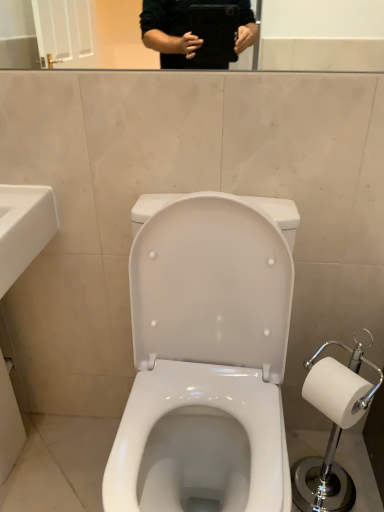
Where is `white plastic toilet paper holder at right`? The image size is (384, 512). white plastic toilet paper holder at right is located at coordinates (332, 428).

From the image's perspective, which one is positioned higher, white ceramic sink at lower left or white plastic toilet paper holder at right?

From the image's view, white ceramic sink at lower left is above.

Is white plastic toilet paper holder at right a part of white ceramic sink at lower left?

Actually, white plastic toilet paper holder at right is outside white ceramic sink at lower left.

Which is in front, point (6, 275) or point (315, 380)?

The point (6, 275) is closer to the camera.

Considering the relative positions of white ceramic sink at lower left and white plastic toilet paper holder at right in the image provided, is white ceramic sink at lower left to the right of white plastic toilet paper holder at right from the viewer's perspective?

Incorrect, white ceramic sink at lower left is not on the right side of white plastic toilet paper holder at right.

Consider the image. Measure the distance from white glossy toilet at center to white ceramic sink at lower left.

white glossy toilet at center and white ceramic sink at lower left are 19.01 inches apart.

Are white glossy toilet at center and white ceramic sink at lower left beside each other?

No, white glossy toilet at center is not touching white ceramic sink at lower left.

In the image, is white glossy toilet at center positioned in front of or behind white ceramic sink at lower left?

white glossy toilet at center is in front of white ceramic sink at lower left.

From a real-world perspective, is white glossy toilet at center physically located above or below white ceramic sink at lower left?

In terms of real-world spatial position, white glossy toilet at center is below white ceramic sink at lower left.

Is white plastic toilet paper holder at right to the left or to the right of white glossy toilet at center in the image?

Based on their positions, white plastic toilet paper holder at right is located to the right of white glossy toilet at center.

What's the angular difference between white plastic toilet paper holder at right and white glossy toilet at center's facing directions?

44.1 degrees separate the facing orientations of white plastic toilet paper holder at right and white glossy toilet at center.

Does white plastic toilet paper holder at right have a larger size compared to white glossy toilet at center?

Actually, white plastic toilet paper holder at right might be smaller than white glossy toilet at center.

In order to click on toilet on the left side of white plastic toilet paper holder at right in this screenshot , I will do `click(205, 361)`.

Is white ceramic sink at lower left located outside white glossy toilet at center?

white ceramic sink at lower left lies outside white glossy toilet at center's area.

How far apart are white ceramic sink at lower left and white glossy toilet at center?

48.27 centimeters.

What are the coordinates of `toilet in front of the white ceramic sink at lower left` in the screenshot? It's located at (205, 361).

Based on the photo, does white ceramic sink at lower left have a greater width compared to white glossy toilet at center?

No.

From the image's perspective, would you say white plastic toilet paper holder at right is shown under white ceramic sink at lower left?

Yes.

Looking at their sizes, would you say white plastic toilet paper holder at right is wider or thinner than white ceramic sink at lower left?

Considering their sizes, white plastic toilet paper holder at right looks slimmer than white ceramic sink at lower left.

Considering the positions of objects white plastic toilet paper holder at right and white ceramic sink at lower left in the image provided, who is in front, white plastic toilet paper holder at right or white ceramic sink at lower left?

white ceramic sink at lower left is closer to the camera.

Find the location of `sink on the left of white plastic toilet paper holder at right`. sink on the left of white plastic toilet paper holder at right is located at coordinates (24, 228).

Is the depth of white glossy toilet at center greater than that of white plastic toilet paper holder at right?

No, white glossy toilet at center is closer to the camera.

From their relative heights in the image, would you say white glossy toilet at center is taller or shorter than white plastic toilet paper holder at right?

In the image, white glossy toilet at center appears to be taller than white plastic toilet paper holder at right.

Do you think white glossy toilet at center is within white plastic toilet paper holder at right, or outside of it?

white glossy toilet at center is located beyond the bounds of white plastic toilet paper holder at right.

The height and width of the screenshot is (512, 384). What are the coordinates of `sink to the left of white plastic toilet paper holder at right` in the screenshot? It's located at (24, 228).

Identify the location of sink above the white glossy toilet at center (from a real-world perspective). The height and width of the screenshot is (512, 384). (24, 228).

When comparing their distances from white glossy toilet at center, does white plastic toilet paper holder at right or white ceramic sink at lower left seem closer?

The object closer to white glossy toilet at center is white ceramic sink at lower left.

Based on their spatial positions, is white glossy toilet at center or white ceramic sink at lower left further from white plastic toilet paper holder at right?

white ceramic sink at lower left is positioned further to the anchor white plastic toilet paper holder at right.

Consider the image. Looking at the image, which one is located closer to white glossy toilet at center, white ceramic sink at lower left or white plastic toilet paper holder at right?

Among the two, white ceramic sink at lower left is located nearer to white glossy toilet at center.

Considering their positions, is white plastic toilet paper holder at right positioned further to white ceramic sink at lower left than white glossy toilet at center?

white plastic toilet paper holder at right.

Which object lies further to the anchor point white ceramic sink at lower left, white glossy toilet at center or white plastic toilet paper holder at right?

white plastic toilet paper holder at right is positioned further to the anchor white ceramic sink at lower left.

In the scene shown: Based on their spatial positions, is white ceramic sink at lower left or white glossy toilet at center further from white plastic toilet paper holder at right?

Among the two, white ceramic sink at lower left is located further to white plastic toilet paper holder at right.

The width and height of the screenshot is (384, 512). I want to click on toilet between white ceramic sink at lower left and white plastic toilet paper holder at right in the horizontal direction, so click(205, 361).